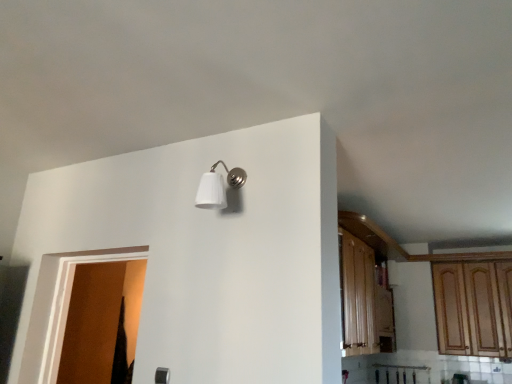
Question: From a real-world perspective, relative to white matte wall sconce at upper center, is brown matte door at left vertically above or below?

Choices:
 (A) below
 (B) above

Answer: (A)

Question: Would you say brown matte door at left is to the left or to the right of white matte wall sconce at upper center in the picture?

Choices:
 (A) left
 (B) right

Answer: (A)

Question: Which object is the closest to the brown matte door at left?

Choices:
 (A) wooden cabinet at right
 (B) white matte wall sconce at upper center

Answer: (B)

Question: Which object is the farthest from the white matte wall sconce at upper center?

Choices:
 (A) wooden cabinet at right
 (B) brown matte door at left

Answer: (A)